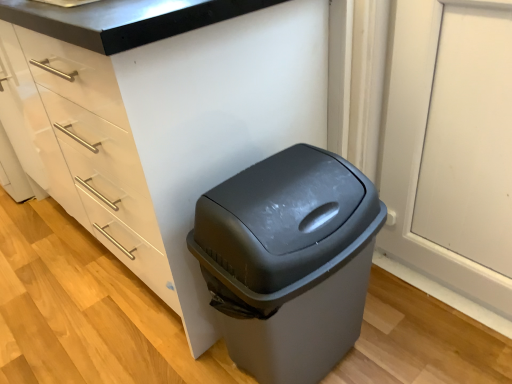
The width and height of the screenshot is (512, 384). In order to click on vacant space situated above gray plastic trash can at center (from a real-world perspective) in this screenshot , I will do `click(273, 181)`.